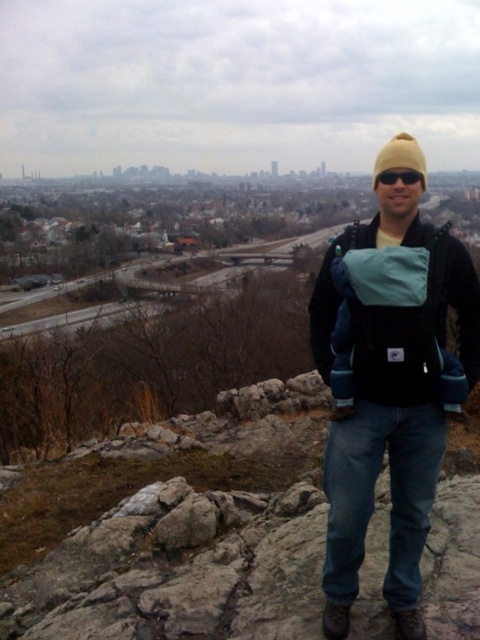
Based on the photo, you are a photographer planning to take a picture of the person in the scene. The person is wearing a black fleece jacket at center. To ensure the jacket is clearly visible in the photo, where should you position the camera relative to the jacket?

The black fleece jacket at center is located at point (388, 388), so position the camera directly facing this coordinate to ensure the jacket is centered and clearly visible in the photo.

You are a photographer trying to capture a closeup of the black fleece jacket at center and the black plastic sunglasses at center. If your camera can only focus on objects within 30 inches, will you need to adjust your position?

The black fleece jacket at center is 39.18 inches away from black plastic sunglasses at center. Since the camera can only focus within 30 inches, you need to move closer to ensure both are within range.